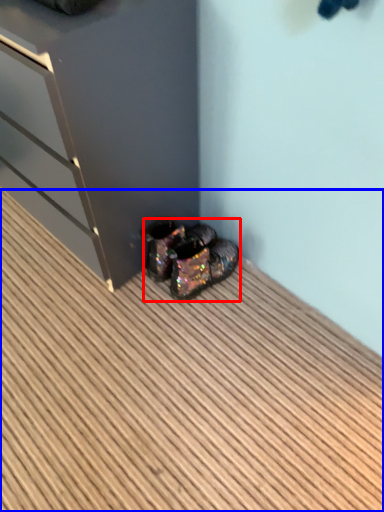
Question: Which object is further to the camera taking this photo, footwear (highlighted by a red box) or hardwood (highlighted by a blue box)?

Choices:
 (A) footwear
 (B) hardwood

Answer: (A)